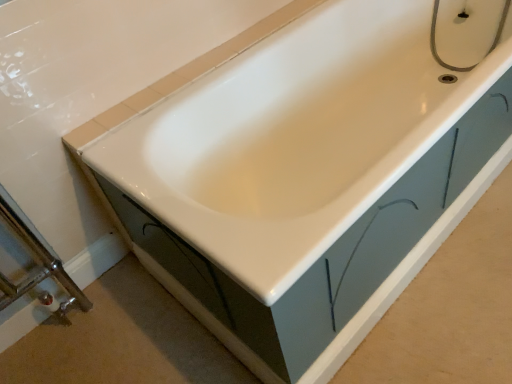
Locate an element on the screen. vacant space underneath brushed metal shower door at lower left (from a real-world perspective) is located at coordinates (42, 328).